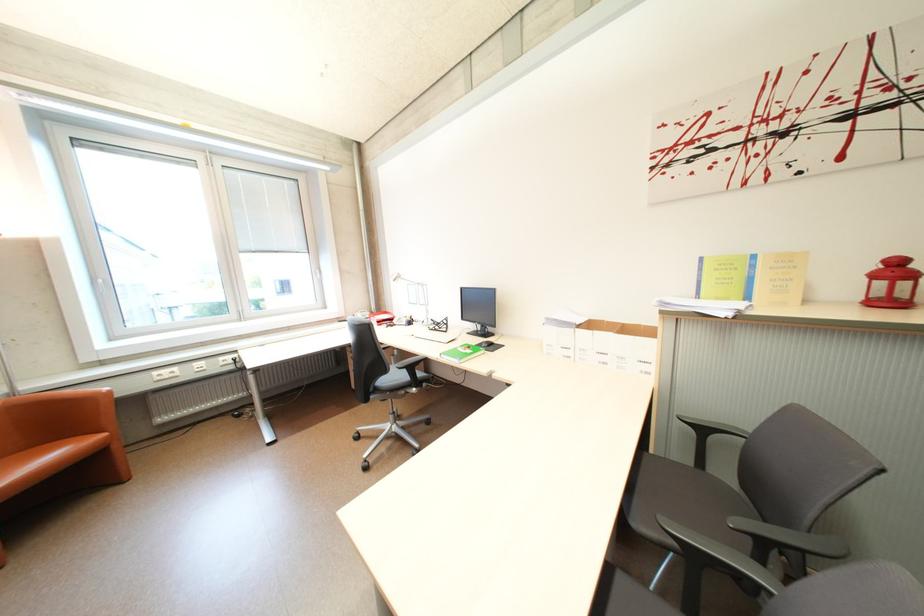
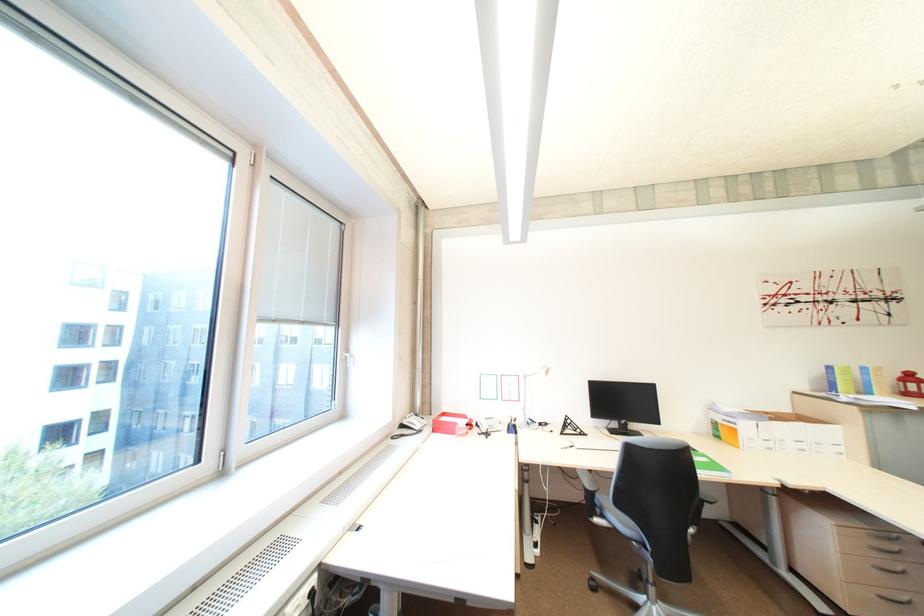
Find the pixel in the second image that matches pixel 882 277 in the first image.

(913, 382)